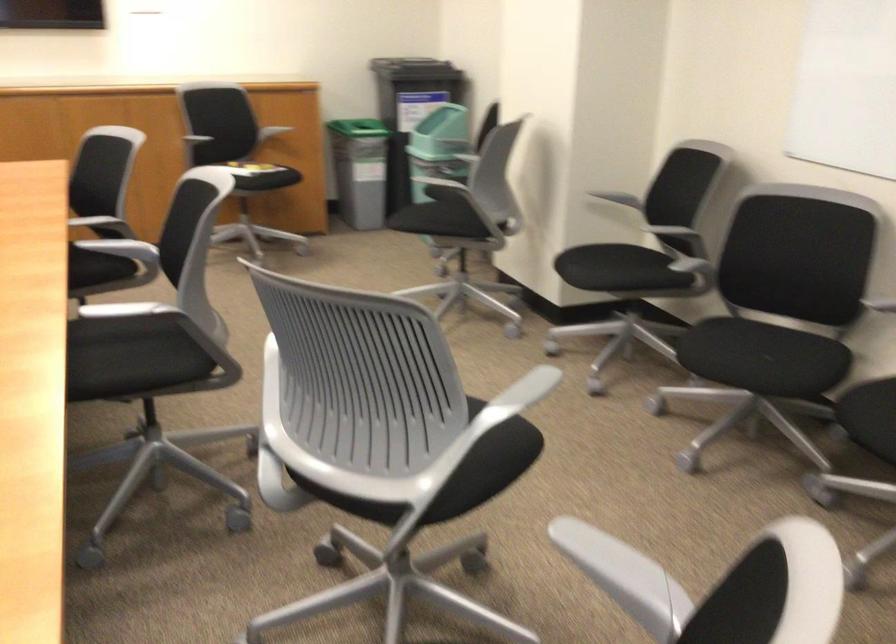
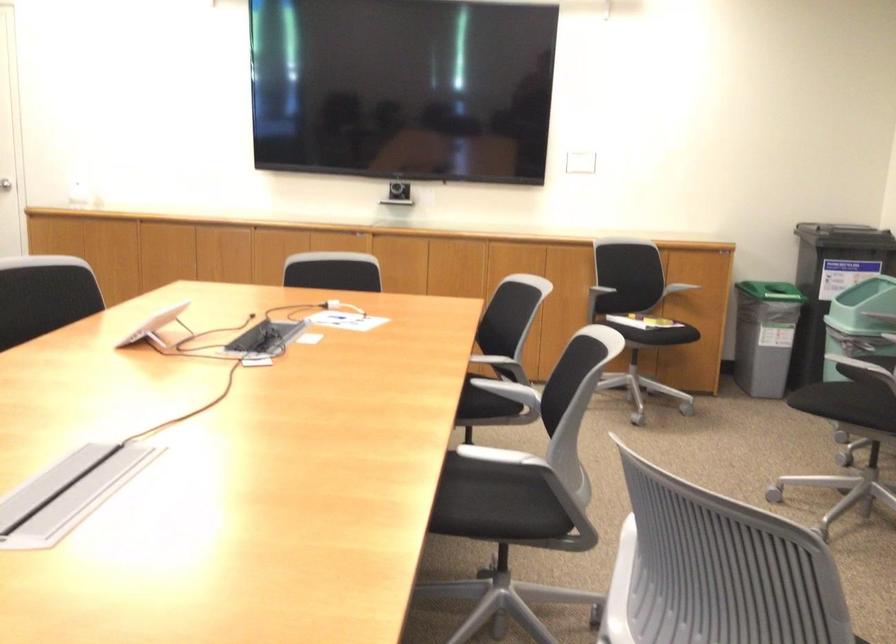
Question: The first image is from the beginning of the video and the second image is from the end. How did the camera likely rotate when shooting the video?

Choices:
 (A) Left
 (B) Right
 (C) Up
 (D) Down

Answer: (A)